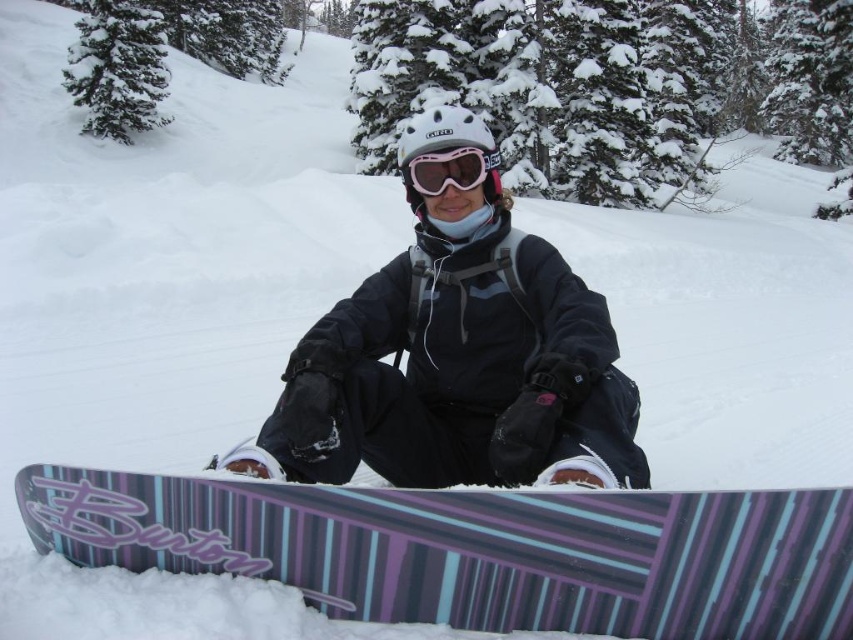
Question: Which point is closer to the camera?

Choices:
 (A) pink reflective goggles at center
 (B) black matte snowboarder at center

Answer: (B)

Question: Which is farther from the black matte snowboarder at center?

Choices:
 (A) purple striped snowboard at lower center
 (B) pink reflective goggles at center

Answer: (A)

Question: Is black matte snowboarder at center closer to camera compared to pink reflective goggles at center?

Choices:
 (A) no
 (B) yes

Answer: (B)

Question: Is black matte snowboarder at center positioned in front of pink reflective goggles at center?

Choices:
 (A) no
 (B) yes

Answer: (B)

Question: Is black matte snowboarder at center wider than pink reflective goggles at center?

Choices:
 (A) no
 (B) yes

Answer: (B)

Question: Which of the following is the farthest from the observer?

Choices:
 (A) (489, 170)
 (B) (360, 408)

Answer: (A)